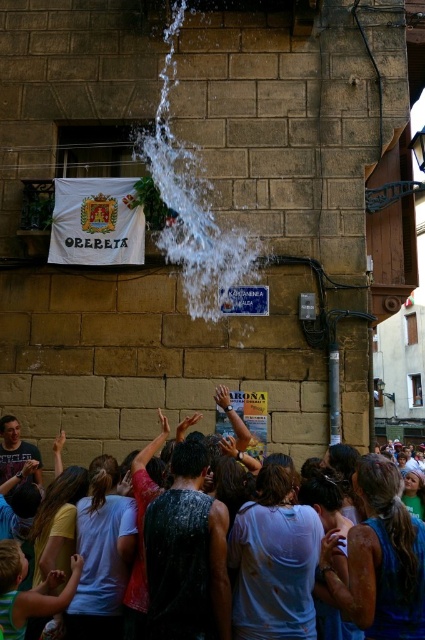
Question: Which of the following is the farthest from the observer?

Choices:
 (A) (76, 490)
 (B) (144, 156)

Answer: (B)

Question: Does white frothy water at center have a lesser width compared to wet skin crowd at lower center?

Choices:
 (A) no
 (B) yes

Answer: (B)

Question: Does white frothy water at center appear over wet skin crowd at lower center?

Choices:
 (A) no
 (B) yes

Answer: (B)

Question: Which of the following is the farthest from the observer?

Choices:
 (A) (166, 144)
 (B) (62, 545)

Answer: (A)

Question: Does white frothy water at center appear on the right side of wet skin crowd at lower center?

Choices:
 (A) yes
 (B) no

Answer: (B)

Question: Among these objects, which one is farthest from the camera?

Choices:
 (A) wet skin crowd at lower center
 (B) white frothy water at center

Answer: (B)